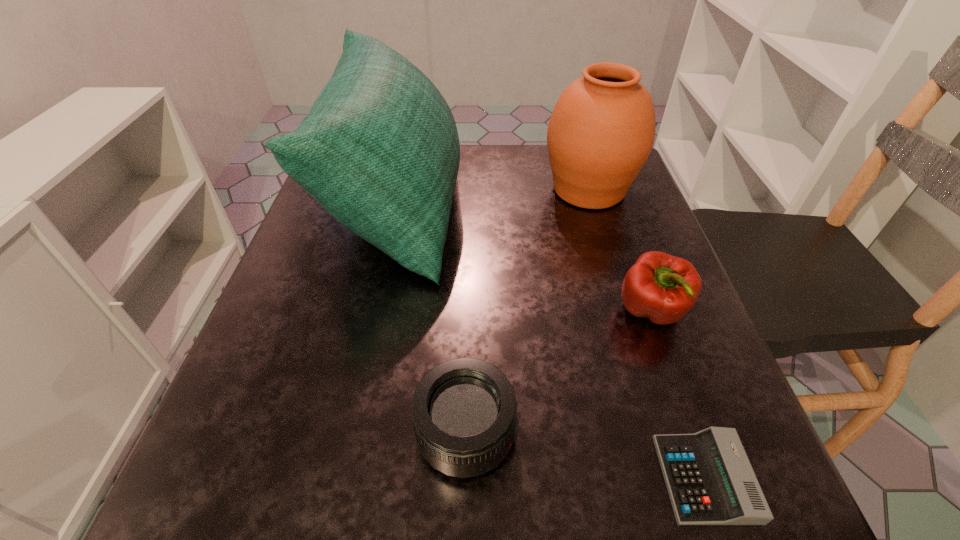
Find the location of a particular element. This screenshot has height=540, width=960. free space between the shortest object and the third shortest object is located at coordinates (678, 395).

The image size is (960, 540). What are the coordinates of `free point between the telephoto lens and the cushion` in the screenshot? It's located at (432, 319).

At what (x,y) coordinates should I click in order to perform the action: click on free space between the fourth tallest object and the bell pepper. Please return your answer as a coordinate pair (x, y). Image resolution: width=960 pixels, height=540 pixels. Looking at the image, I should click on (559, 373).

Image resolution: width=960 pixels, height=540 pixels. In order to click on vacant point located between the urn and the calculator in this screenshot , I will do `click(646, 334)`.

What are the coordinates of `vacant point located between the telephoto lens and the cushion` in the screenshot? It's located at (432, 319).

Locate an element on the screen. blank region between the calculator and the urn is located at coordinates (646, 334).

Identify which object is the third nearest to the second shortest object. Please provide its 2D coordinates. Your answer should be formatted as a tuple, i.e. [(x, y)], where the tuple contains the x and y coordinates of a point satisfying the conditions above.

[(379, 150)]

Locate which object ranks second in proximity to the telephoto lens. Please provide its 2D coordinates. Your answer should be formatted as a tuple, i.e. [(x, y)], where the tuple contains the x and y coordinates of a point satisfying the conditions above.

[(663, 288)]

Where is `free space that satisfies the following two spatial constraints: 1. on the front side of the urn; 2. on the side of the second shortest object with brand markings and control switches`? Image resolution: width=960 pixels, height=540 pixels. free space that satisfies the following two spatial constraints: 1. on the front side of the urn; 2. on the side of the second shortest object with brand markings and control switches is located at coordinates (663, 434).

Where is `vacant space that satisfies the following two spatial constraints: 1. on the back side of the shortest object; 2. on the right side of the third tallest object`? vacant space that satisfies the following two spatial constraints: 1. on the back side of the shortest object; 2. on the right side of the third tallest object is located at coordinates (646, 312).